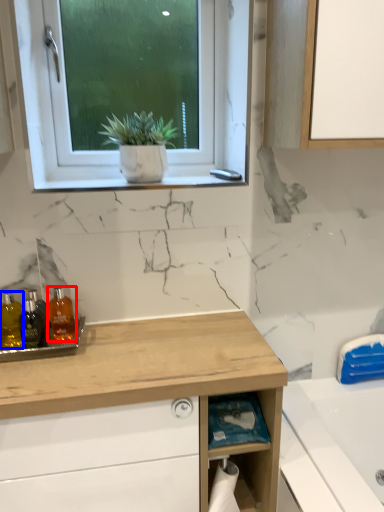
Question: Which object appears farthest to the camera in this image, toiletry (highlighted by a red box) or toiletry (highlighted by a blue box)?

Choices:
 (A) toiletry
 (B) toiletry

Answer: (A)